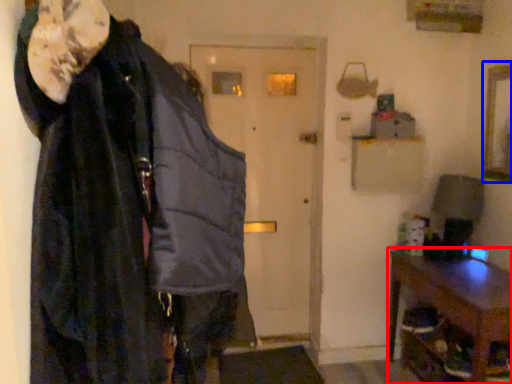
Question: Which object is closer to the camera taking this photo, furniture (highlighted by a red box) or picture frame (highlighted by a blue box)?

Choices:
 (A) furniture
 (B) picture frame

Answer: (A)